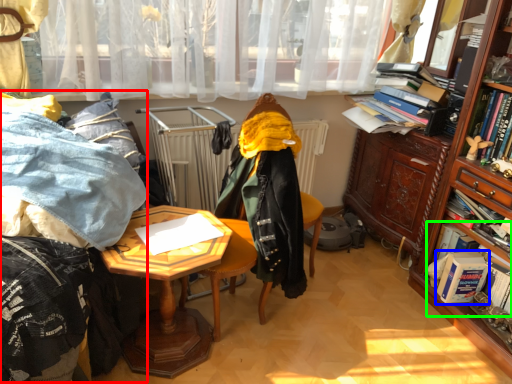
Question: Based on their relative distances, which object is farther from bedding (highlighted by a red box)? Choose from book (highlighted by a blue box) and book (highlighted by a green box).

Choices:
 (A) book
 (B) book

Answer: (A)